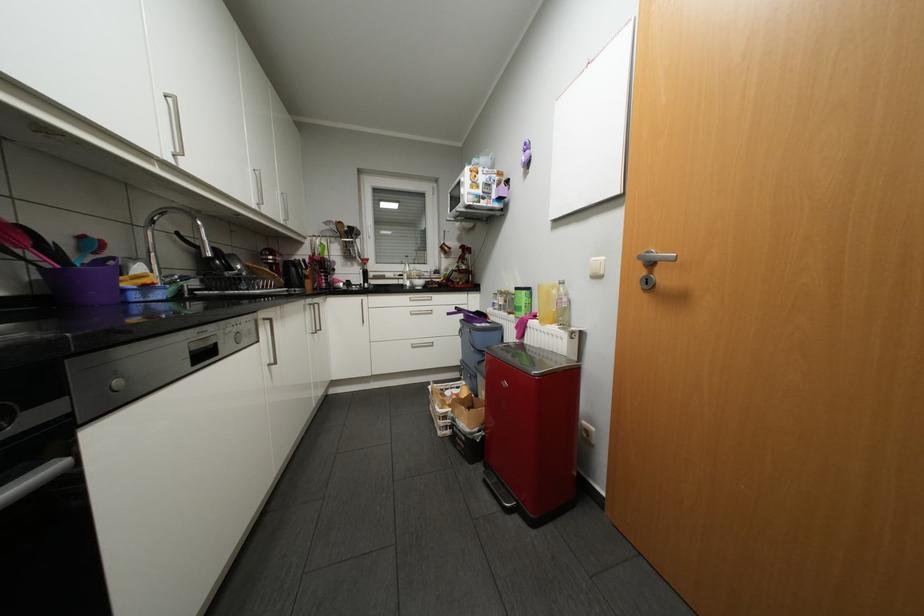
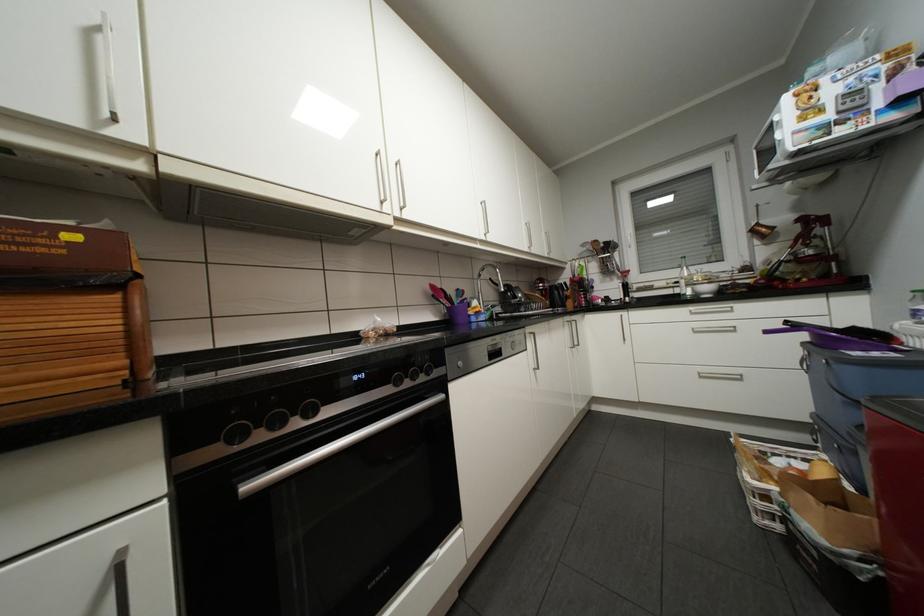
Where in the second image is the point corresponding to (x=472, y=248) from the first image?

(819, 220)